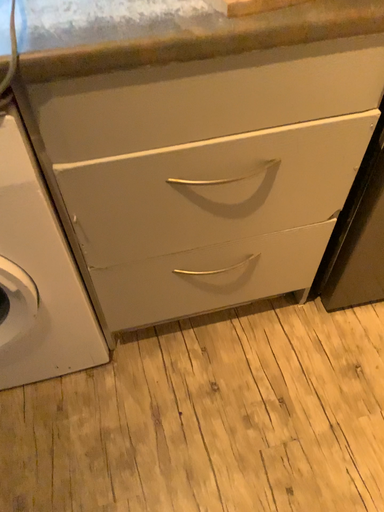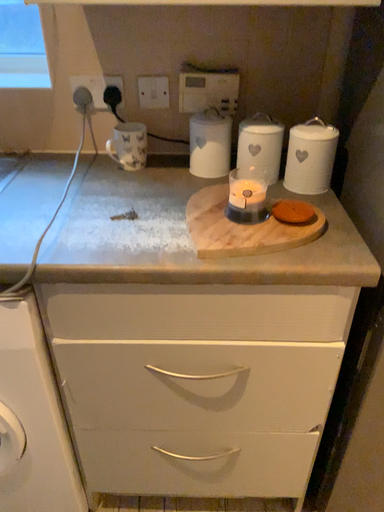
Question: Which way did the camera rotate in the video?

Choices:
 (A) rotated left
 (B) rotated right

Answer: (A)